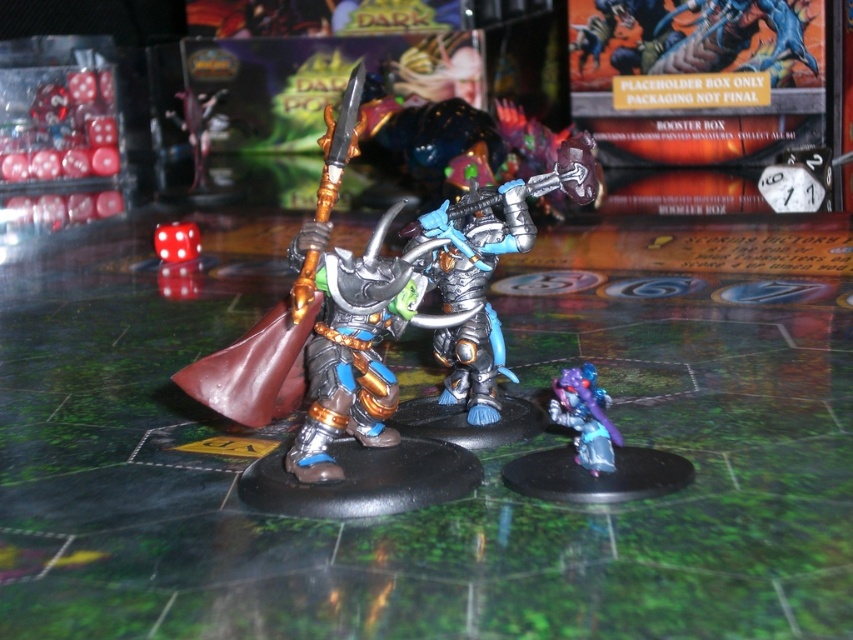
Who is higher up, metallic blue figure at lower right or white plastic die at center?

white plastic die at center is above.

Which is more to the right, metallic blue figure at lower right or white plastic die at center?

→ white plastic die at center

Describe the element at coordinates (592, 452) in the screenshot. I see `metallic blue figure at lower right` at that location.

Where is `metallic blue figure at lower right`? metallic blue figure at lower right is located at coordinates (592, 452).

Is metallic silver armor at center bigger than white plastic clock at upper right?

Correct, metallic silver armor at center is larger in size than white plastic clock at upper right.

Is point (473, 349) in front of point (786, 179)?

Yes, point (473, 349) is in front of point (786, 179).

Does point (459, 234) lie behind point (780, 182)?

No.

The width and height of the screenshot is (853, 640). I want to click on metallic silver armor at center, so click(486, 269).

Is metallic silver armor at center shorter than translucent red dice at left?

Correct, metallic silver armor at center is not as tall as translucent red dice at left.

Who is more distant from viewer, (589, 141) or (74, 131)?

Positioned behind is point (74, 131).

Which is in front, point (463, 204) or point (78, 179)?

Point (463, 204) is in front.

Identify the location of metallic silver armor at center. The height and width of the screenshot is (640, 853). pos(486,269).